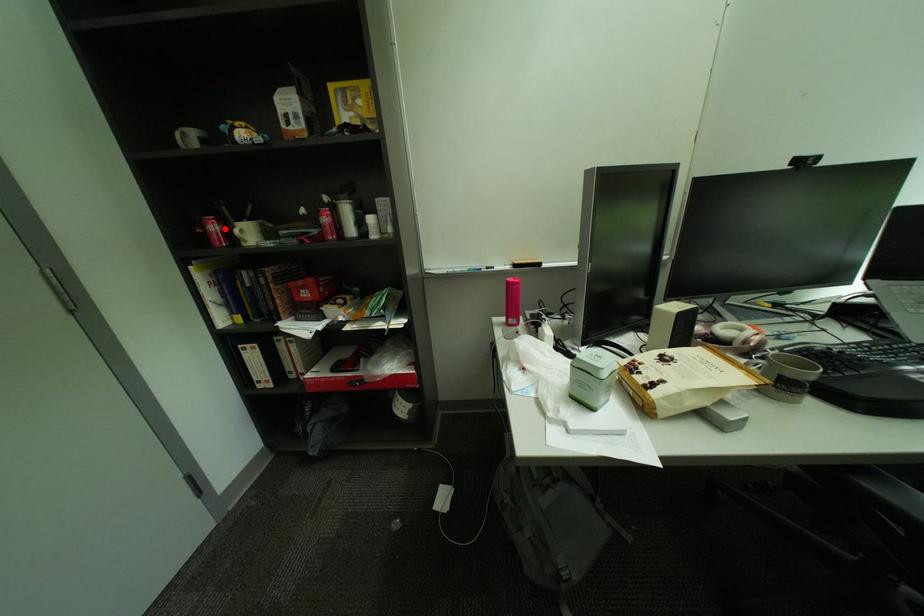
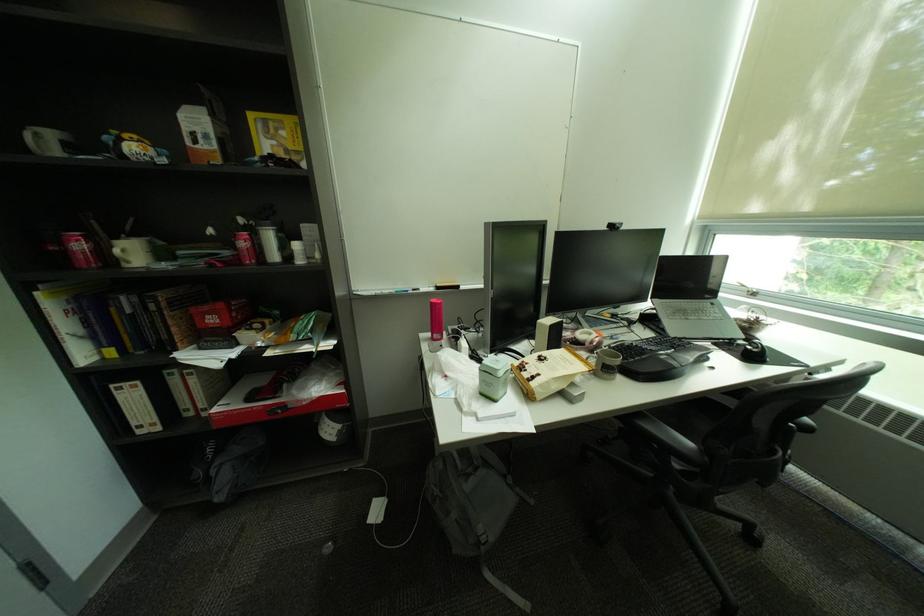
Question: I am providing you with two images of the same scene from different viewpoints. A red point is marked on the first image. Can you still see the location of the red point in image 2?

Choices:
 (A) Yes
 (B) No

Answer: (A)